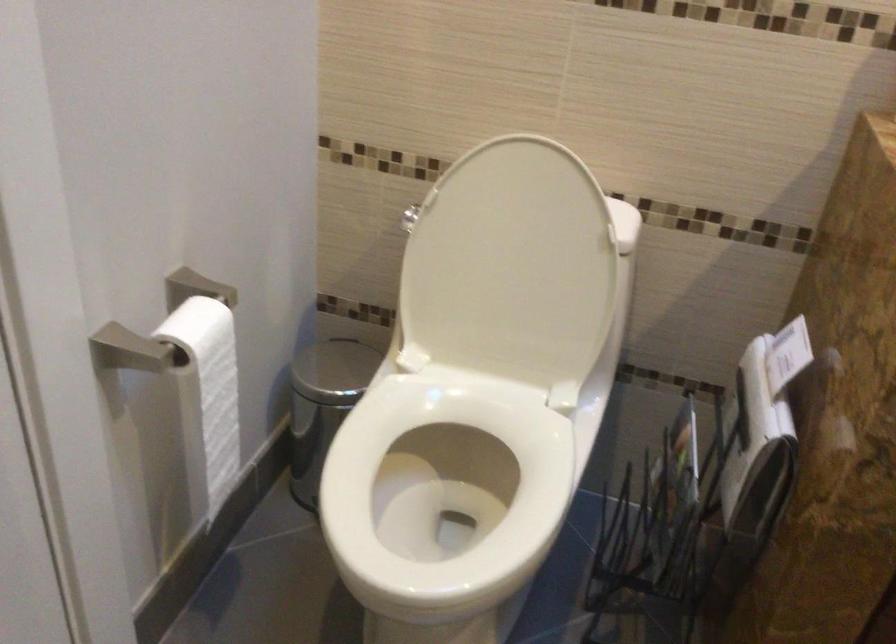
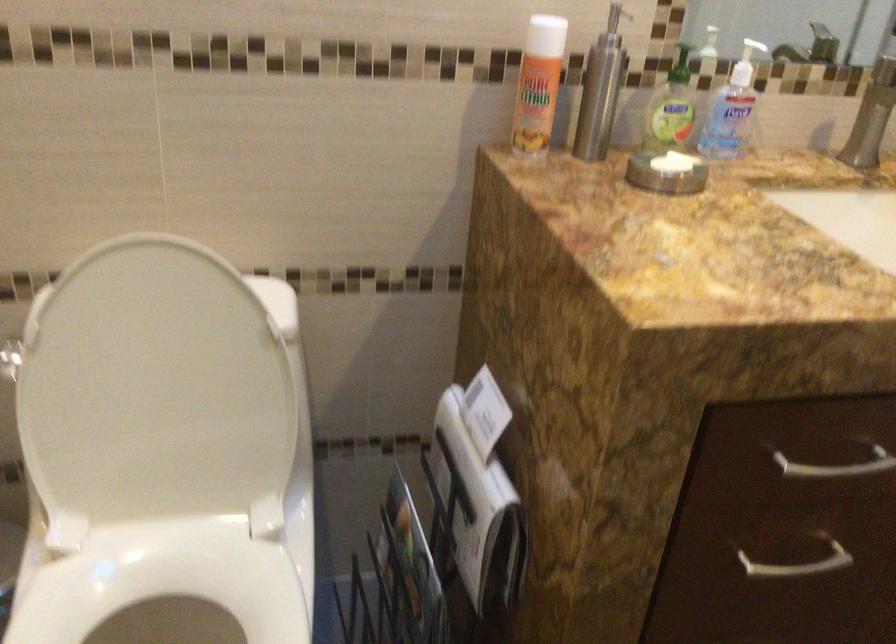
Where in the second image is the point corresponding to point (468, 438) from the first image?

(166, 594)